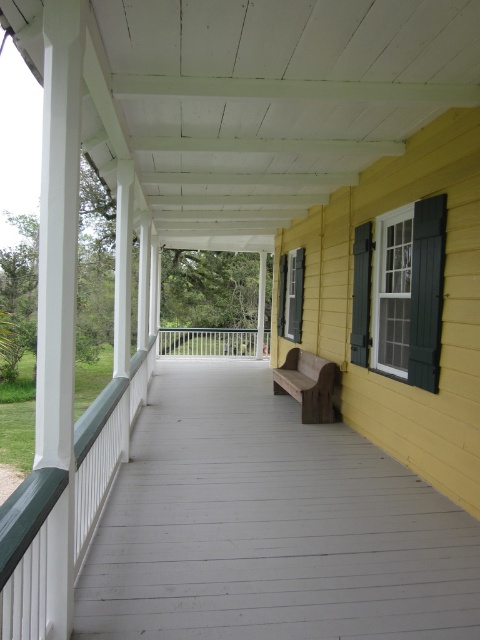
Looking at this image, does silver metallic rail at center appear under green painted wood shutter at upper right?

Yes.

Which is above, silver metallic rail at center or green painted wood shutter at upper right?

green painted wood shutter at upper right is above.

Who is more distant from viewer, (268, 336) or (300, 332)?

The point (268, 336) is more distant.

The height and width of the screenshot is (640, 480). I want to click on silver metallic rail at center, so click(207, 340).

Based on the photo, can you confirm if white painted wood porch at center is positioned above wooden bench at center?

Actually, white painted wood porch at center is below wooden bench at center.

The height and width of the screenshot is (640, 480). What do you see at coordinates (266, 518) in the screenshot?
I see `white painted wood porch at center` at bounding box center [266, 518].

Find the location of a particular element. The height and width of the screenshot is (640, 480). white painted wood porch at center is located at coordinates (266, 518).

Is wooden bench at center in front of green painted wood shutter at upper right?

Yes, it is in front of green painted wood shutter at upper right.

Find the location of a particular element. The image size is (480, 640). wooden bench at center is located at coordinates (308, 385).

You are a GUI agent. You are given a task and a screenshot of the screen. Output one action in this format:
    pyautogui.click(x=<x>, y=<y>)
    Task: Click on the wooden bench at center
    The width and height of the screenshot is (480, 640).
    Given the screenshot: What is the action you would take?
    pyautogui.click(x=308, y=385)